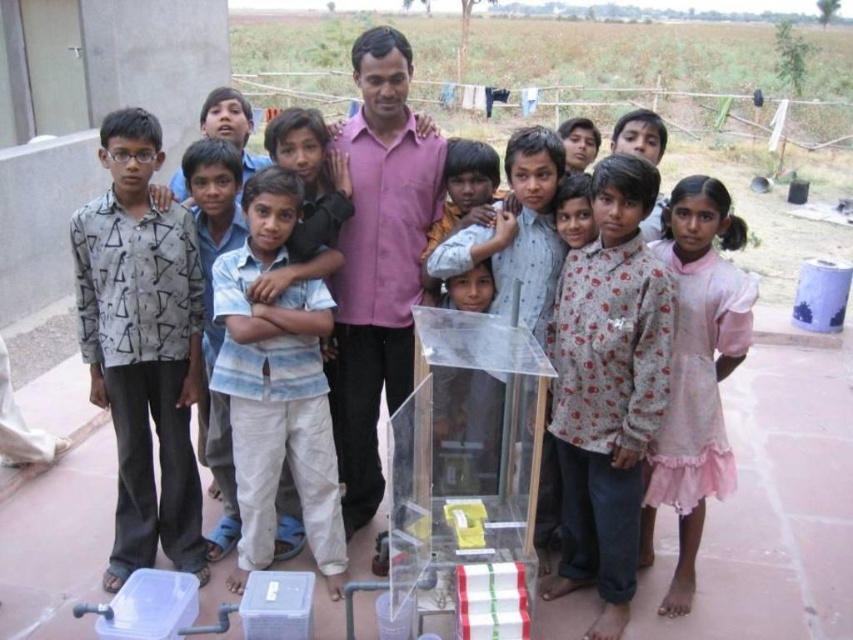
Which is below, floral-patterned shirt at center or light brown fabric shirt at center?

floral-patterned shirt at center is lower down.

Is floral-patterned shirt at center to the right of light brown fabric shirt at center from the viewer's perspective?

Indeed, floral-patterned shirt at center is positioned on the right side of light brown fabric shirt at center.

Describe the element at coordinates (608, 388) in the screenshot. The width and height of the screenshot is (853, 640). I see `floral-patterned shirt at center` at that location.

You are a GUI agent. You are given a task and a screenshot of the screen. Output one action in this format:
    pyautogui.click(x=<x>, y=<y>)
    Task: Click on the floral-patterned shirt at center
    
    Given the screenshot: What is the action you would take?
    pyautogui.click(x=608, y=388)

Does blue striped shirt at center have a greater width compared to pink satin dress at center?

Yes.

Does blue striped shirt at center have a larger size compared to pink satin dress at center?

Incorrect, blue striped shirt at center is not larger than pink satin dress at center.

What do you see at coordinates (277, 387) in the screenshot? I see `blue striped shirt at center` at bounding box center [277, 387].

The width and height of the screenshot is (853, 640). What are the coordinates of `blue striped shirt at center` in the screenshot? It's located at (277, 387).

Which of these two, printed cotton shirt at left or blue striped shirt at center, stands taller?

printed cotton shirt at left is taller.

Which is above, printed cotton shirt at left or blue striped shirt at center?

Positioned higher is printed cotton shirt at left.

Find the location of a particular element. printed cotton shirt at left is located at coordinates (142, 346).